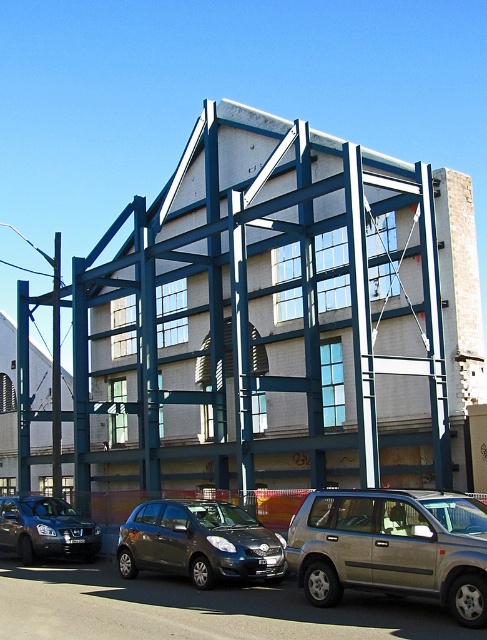
You are a delivery driver who needs to park your vehicle at the construction site. The construction site has a steel framework painted in deep blue. There is a point marked at coordinates (199, 541) where a satin dark gray hatchback is parked. Can you safely park your vehicle near this point without blocking the entrance?

The satin dark gray hatchback at center is already parked at point (199, 541), so you should avoid parking too close to this location to prevent blocking the entrance.

You are a delivery driver with a truck that is 4 meters long. You need to park your truck between the gold metallic suv at center and the satin dark gray hatchback at center. Is there enough space between them to park your truck?

The gold metallic suv at center and satin dark gray hatchback at center are 3.61 meters apart from each other. Since your truck is 4 meters long, there isn not enough space to park between them.

You are standing in front of the partially constructed building and want to determine the relative positions of two points marked on the steel framework. Which of the two points, point (116, 282) or point (30, 545), is closer to your current position?

Point (30, 545) is closer to your current position because it is nearer to the camera compared to point (116, 282), which is further away.